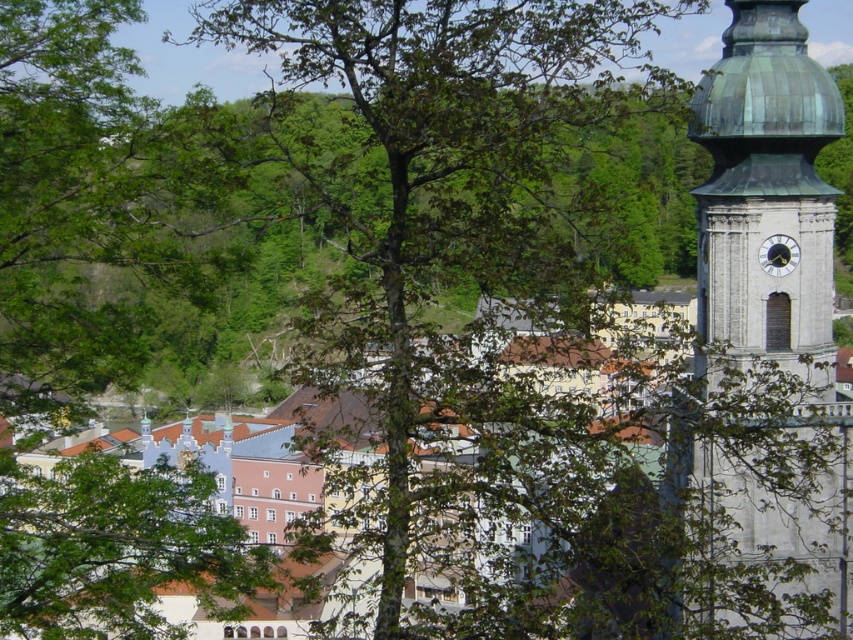
Question: Where is green copper dome at right located in relation to white metallic clock at upper right in the image?

Choices:
 (A) below
 (B) above

Answer: (A)

Question: Does green copper dome at right appear under white metallic clock at upper right?

Choices:
 (A) no
 (B) yes

Answer: (B)

Question: Does green copper dome at right have a smaller size compared to white metallic clock at upper right?

Choices:
 (A) no
 (B) yes

Answer: (A)

Question: Which point is closer to the camera?

Choices:
 (A) (735, 76)
 (B) (773, 244)

Answer: (A)

Question: Which point is closer to the camera?

Choices:
 (A) white metallic clock at upper right
 (B) green copper dome at right

Answer: (B)